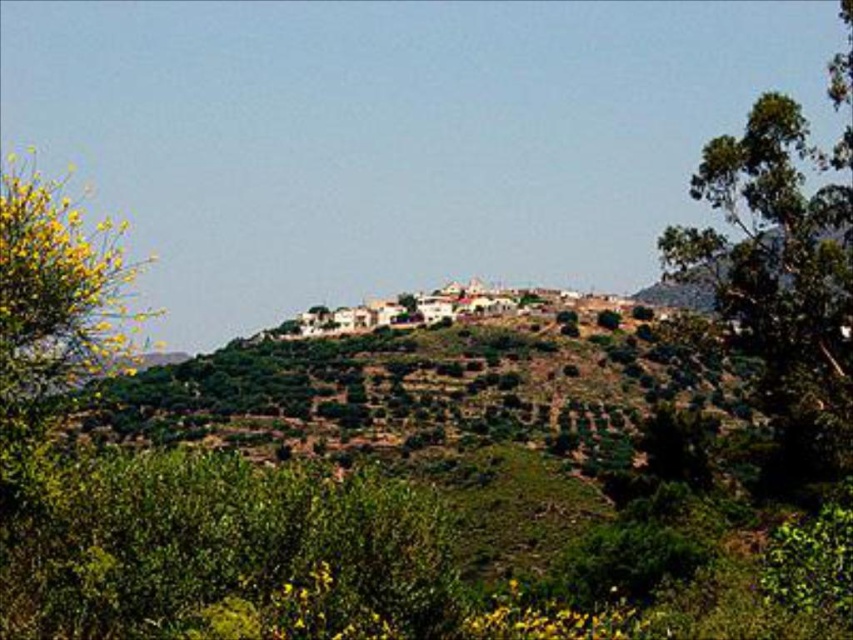
Question: Is green leafy tree at right bigger than yellow-green leafy bush at left?

Choices:
 (A) yes
 (B) no

Answer: (B)

Question: Which of the following is the closest to the observer?

Choices:
 (A) green leafy tree at right
 (B) yellow-green leafy bush at left

Answer: (B)

Question: Can you confirm if green leafy tree at right is wider than yellow-green leafy bush at left?

Choices:
 (A) no
 (B) yes

Answer: (A)

Question: Which of the following is the farthest from the observer?

Choices:
 (A) (125, 346)
 (B) (790, 129)

Answer: (B)

Question: Which of the following is the farthest from the observer?

Choices:
 (A) (132, 346)
 (B) (735, 154)

Answer: (A)

Question: From the image, what is the correct spatial relationship of green leafy tree at right in relation to yellow-green leafy bush at left?

Choices:
 (A) above
 (B) below

Answer: (B)